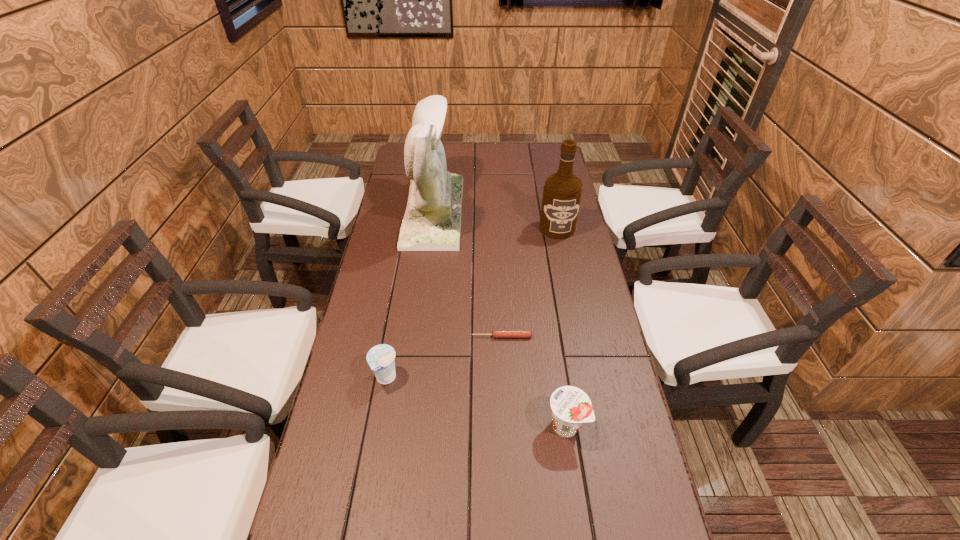
You are a GUI agent. You are given a task and a screenshot of the screen. Output one action in this format:
    pyautogui.click(x=<x>, y=<y>)
    Task: Click on the free space between the second tallest object and the farther yogurt
    
    Given the screenshot: What is the action you would take?
    pos(471,303)

Locate an element on the screen. object that ranks as the second closest to the right yogurt is located at coordinates (380, 358).

Where is `object that is the nearest to the fourth shortest object`? object that is the nearest to the fourth shortest object is located at coordinates (432, 219).

Where is `free space in the image that satisfies the following two spatial constraints: 1. on the back side of the right yogurt; 2. on the base of the tallest object`? The width and height of the screenshot is (960, 540). free space in the image that satisfies the following two spatial constraints: 1. on the back side of the right yogurt; 2. on the base of the tallest object is located at coordinates tap(534, 211).

This screenshot has height=540, width=960. I want to click on vacant space that satisfies the following two spatial constraints: 1. on the base of the nearest object; 2. on the left side of the sculpture, so click(x=406, y=426).

Locate an element on the screen. This screenshot has height=540, width=960. blank space that satisfies the following two spatial constraints: 1. on the base of the third object from right to left; 2. on the right side of the tallest object is located at coordinates (418, 336).

This screenshot has width=960, height=540. What are the coordinates of `vacant point that satisfies the following two spatial constraints: 1. on the back side of the left yogurt; 2. on the left side of the third farthest object` in the screenshot? It's located at (394, 336).